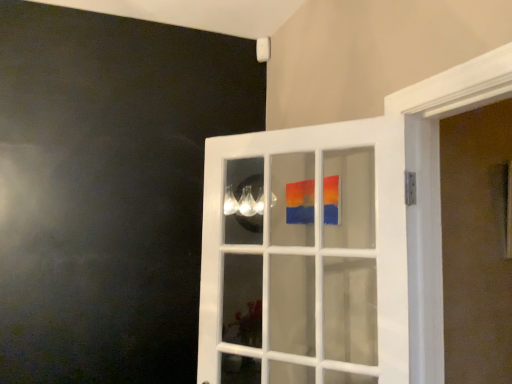
The width and height of the screenshot is (512, 384). What do you see at coordinates (305, 256) in the screenshot?
I see `white glass door at center` at bounding box center [305, 256].

Locate an element on the screen. white glass door at center is located at coordinates click(305, 256).

Find the location of a particular element. white glass door at center is located at coordinates (305, 256).